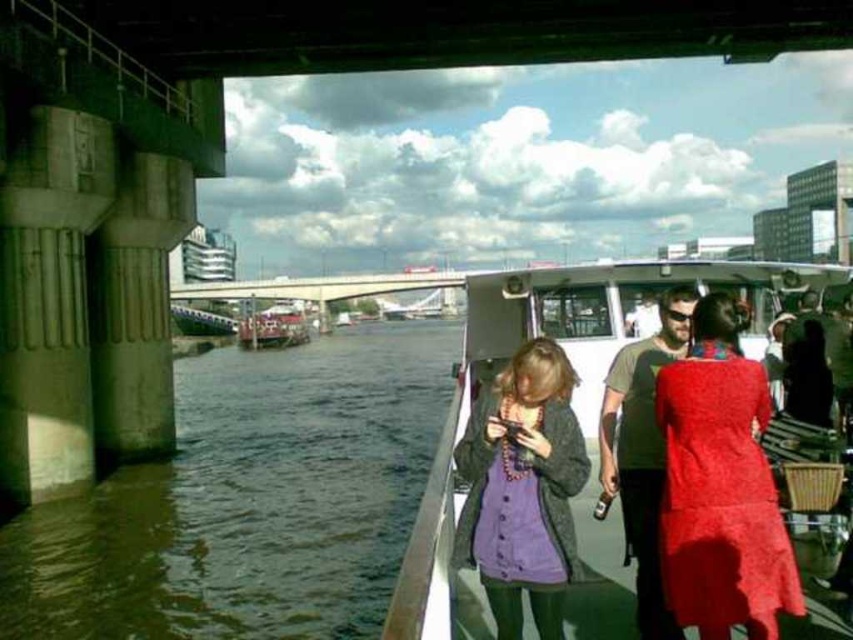
Question: Considering the relative positions of brown murky water at lower left and matte red dress at center in the image provided, where is brown murky water at lower left located with respect to matte red dress at center?

Choices:
 (A) right
 (B) left

Answer: (B)

Question: Is white plastic boat at center smaller than metallic silver boat at center?

Choices:
 (A) yes
 (B) no

Answer: (B)

Question: Can you confirm if brown murky water at lower left is positioned above matte purple dress at center?

Choices:
 (A) yes
 (B) no

Answer: (B)

Question: Which point appears farthest from the camera in this image?

Choices:
 (A) (700, 586)
 (B) (283, 317)
 (C) (547, 561)
 (D) (474, 586)

Answer: (B)

Question: Which object is closer to the camera taking this photo?

Choices:
 (A) white plastic boat at center
 (B) matte red dress at center
 (C) matte purple dress at center

Answer: (A)

Question: Which point is closer to the camera?

Choices:
 (A) (345, 608)
 (B) (520, 362)

Answer: (B)